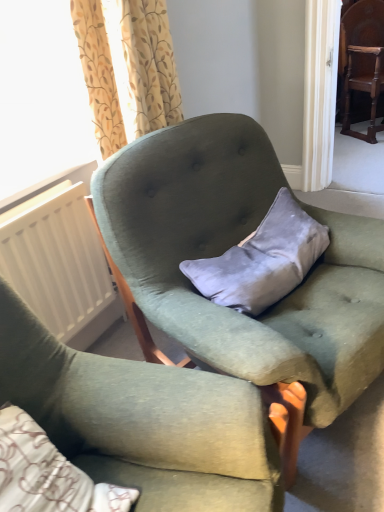
Describe the element at coordinates (142, 421) in the screenshot. I see `velvet green armchair at center, the 1th chair when ordered from front to back` at that location.

The width and height of the screenshot is (384, 512). What do you see at coordinates (228, 248) in the screenshot?
I see `velvet green armchair at center, the second chair positioned from the right` at bounding box center [228, 248].

Describe the element at coordinates (363, 59) in the screenshot. The height and width of the screenshot is (512, 384). I see `dark brown wood chair at upper right, the third chair in the front-to-back sequence` at that location.

You are a GUI agent. You are given a task and a screenshot of the screen. Output one action in this format:
    pyautogui.click(x=<x>, y=<y>)
    Task: Click on the velvet gray pillow at center
    
    Given the screenshot: What is the action you would take?
    pyautogui.click(x=262, y=260)

From a real-world perspective, who is located lower, white plastic radiator at left or velvet green armchair at center, placed as the second chair when sorted from front to back?

velvet green armchair at center, placed as the second chair when sorted from front to back, from a real-world perspective.

From the image's perspective, is white plastic radiator at left positioned above or below velvet green armchair at center, placed as the second chair when sorted from back to front?

Based on their image positions, white plastic radiator at left is located beneath velvet green armchair at center, placed as the second chair when sorted from back to front.

Is velvet green armchair at center, marked as the 2th chair in a top-to-bottom arrangement, a part of white plastic radiator at left?

No, white plastic radiator at left does not contain velvet green armchair at center, marked as the 2th chair in a top-to-bottom arrangement.

Considering the relative positions of white plastic radiator at left and velvet green armchair at center, the second chair positioned from the right, in the image provided, is white plastic radiator at left to the left of velvet green armchair at center, the second chair positioned from the right, from the viewer's perspective?

Indeed, white plastic radiator at left is positioned on the left side of velvet green armchair at center, the second chair positioned from the right.

Can you confirm if dark brown wood chair at upper right, which is the third chair from left to right, is taller than velvet green armchair at center, the 2th chair when ordered from bottom to top?

Indeed, dark brown wood chair at upper right, which is the third chair from left to right, has a greater height compared to velvet green armchair at center, the 2th chair when ordered from bottom to top.

How many degrees apart are the facing directions of dark brown wood chair at upper right, the third chair in the front-to-back sequence, and velvet green armchair at center, the second chair positioned from the right?

20.6 degrees separate the facing orientations of dark brown wood chair at upper right, the third chair in the front-to-back sequence, and velvet green armchair at center, the second chair positioned from the right.

Considering the sizes of objects dark brown wood chair at upper right, the 1th chair from the top, and velvet green armchair at center, which ranks as the 2th chair in left-to-right order, in the image provided, who is thinner, dark brown wood chair at upper right, the 1th chair from the top, or velvet green armchair at center, which ranks as the 2th chair in left-to-right order,?

dark brown wood chair at upper right, the 1th chair from the top.

From a real-world perspective, does dark brown wood chair at upper right, which appears as the first chair when viewed from the back, stand above velvet green armchair at center, which ranks as the 2th chair in left-to-right order?

Correct, in the physical world, dark brown wood chair at upper right, which appears as the first chair when viewed from the back, is higher than velvet green armchair at center, which ranks as the 2th chair in left-to-right order.

From a real-world perspective, is velvet green armchair at center, the second chair positioned from the right, under white plastic radiator at left?

Yes, from a real-world perspective, velvet green armchair at center, the second chair positioned from the right, is below white plastic radiator at left.

Between velvet green armchair at center, placed as the second chair when sorted from front to back, and white plastic radiator at left, which one has larger width?

velvet green armchair at center, placed as the second chair when sorted from front to back.

Could you tell me if velvet green armchair at center, which ranks as the 2th chair in left-to-right order, is facing white plastic radiator at left?

No, velvet green armchair at center, which ranks as the 2th chair in left-to-right order, is not facing towards white plastic radiator at left.

Considering the positions of objects white plastic radiator at left and floral-patterned fabric curtain at upper left in the image provided, who is more to the left, white plastic radiator at left or floral-patterned fabric curtain at upper left?

Positioned to the left is white plastic radiator at left.

Is white plastic radiator at left wider or thinner than floral-patterned fabric curtain at upper left?

In the image, white plastic radiator at left appears to be more narrow than floral-patterned fabric curtain at upper left.

Find the location of a particular element. radiator that is under the floral-patterned fabric curtain at upper left (from a real-world perspective) is located at coordinates (59, 265).

Does point (84, 213) come closer to viewer compared to point (117, 13)?

No, it is not.

Who is shorter, floral-patterned fabric curtain at upper left or velvet gray pillow at center?

velvet gray pillow at center is shorter.

From the picture: How far apart are floral-patterned fabric curtain at upper left and velvet gray pillow at center?

floral-patterned fabric curtain at upper left is 24.22 inches from velvet gray pillow at center.

Does floral-patterned fabric curtain at upper left turn towards velvet gray pillow at center?

Yes, floral-patterned fabric curtain at upper left is facing velvet gray pillow at center.

Is velvet green armchair at center, placed as the 3th chair when sorted from back to front, oriented away from velvet gray pillow at center?

That's not correct — velvet green armchair at center, placed as the 3th chair when sorted from back to front, is not looking away from velvet gray pillow at center.

How distant is velvet green armchair at center, the 1th chair when ordered from front to back, from velvet gray pillow at center?

The distance of velvet green armchair at center, the 1th chair when ordered from front to back, from velvet gray pillow at center is 18.98 inches.

Is point (185, 417) closer to camera compared to point (295, 243)?

Yes.

From a real-world perspective, is velvet green armchair at center, acting as the 3th chair starting from the top, physically above velvet gray pillow at center?

Actually, velvet green armchair at center, acting as the 3th chair starting from the top, is physically below velvet gray pillow at center in the real world.

Is velvet green armchair at center, the 2th chair when ordered from bottom to top, located within velvet gray pillow at center?

No, velvet green armchair at center, the 2th chair when ordered from bottom to top, is not surrounded by velvet gray pillow at center.

Considering the sizes of objects velvet gray pillow at center and velvet green armchair at center, the second chair positioned from the right, in the image provided, who is shorter, velvet gray pillow at center or velvet green armchair at center, the second chair positioned from the right,?

Standing shorter between the two is velvet gray pillow at center.

At what (x,y) coordinates should I click in order to perform the action: click on the 1st chair in front of the white plastic radiator at left. Please return your answer as a coordinate pair (x, y). Looking at the image, I should click on (228, 248).

Find the location of a particular element. This screenshot has width=384, height=512. the 1st chair to the left when counting from the dark brown wood chair at upper right, which is the third chair from left to right is located at coordinates (228, 248).

Which object lies nearer to the anchor point velvet green armchair at center, acting as the 3th chair starting from the top, floral-patterned fabric curtain at upper left or dark brown wood chair at upper right, the third chair in the front-to-back sequence?

floral-patterned fabric curtain at upper left is positioned closer to the anchor velvet green armchair at center, acting as the 3th chair starting from the top.

When comparing their distances from white plastic radiator at left, does dark brown wood chair at upper right, the third chair in the front-to-back sequence, or velvet green armchair at center, the 1th chair when ordered from front to back, seem further?

The object further to white plastic radiator at left is dark brown wood chair at upper right, the third chair in the front-to-back sequence.

When comparing their distances from velvet green armchair at center, the 2th chair when ordered from bottom to top, does velvet gray pillow at center or floral-patterned fabric curtain at upper left seem closer?

velvet gray pillow at center is positioned closer to the anchor velvet green armchair at center, the 2th chair when ordered from bottom to top.

When comparing their distances from velvet green armchair at center, the second chair positioned from the right, does white plastic radiator at left or velvet green armchair at center, acting as the 3th chair starting from the top, seem closer?

The object closer to velvet green armchair at center, the second chair positioned from the right, is velvet green armchair at center, acting as the 3th chair starting from the top.

When comparing their distances from dark brown wood chair at upper right, which appears as the first chair when viewed from the back, does velvet green armchair at center, marked as the 2th chair in a top-to-bottom arrangement, or white plastic radiator at left seem further?

white plastic radiator at left lies further to dark brown wood chair at upper right, which appears as the first chair when viewed from the back, than the other object.

Looking at this image, considering their positions, is dark brown wood chair at upper right, which is the third chair in bottom-to-top order, positioned further to floral-patterned fabric curtain at upper left than velvet green armchair at center, which is the 3th chair from right to left?

dark brown wood chair at upper right, which is the third chair in bottom-to-top order.

Looking at the image, which one is located closer to floral-patterned fabric curtain at upper left, white plastic radiator at left or velvet green armchair at center, placed as the second chair when sorted from front to back?

Based on the image, velvet green armchair at center, placed as the second chair when sorted from front to back, appears to be nearer to floral-patterned fabric curtain at upper left.

Considering their positions, is dark brown wood chair at upper right, which appears as the first chair when viewed from the back, positioned further to velvet green armchair at center, the 1th chair when ordered from left to right, than velvet gray pillow at center?

dark brown wood chair at upper right, which appears as the first chair when viewed from the back, lies further to velvet green armchair at center, the 1th chair when ordered from left to right, than the other object.

Locate an element on the screen. radiator between velvet green armchair at center, the 2th chair when ordered from bottom to top, and dark brown wood chair at upper right, the third chair in the front-to-back sequence, along the z-axis is located at coordinates (59, 265).

You are a GUI agent. You are given a task and a screenshot of the screen. Output one action in this format:
    pyautogui.click(x=<x>, y=<y>)
    Task: Click on the curtain between velvet green armchair at center, which ranks as the 2th chair in left-to-right order, and dark brown wood chair at upper right, the third chair in the front-to-back sequence, along the z-axis
    This screenshot has width=384, height=512.
    Given the screenshot: What is the action you would take?
    pyautogui.click(x=127, y=68)

This screenshot has width=384, height=512. What are the coordinates of `chair located between velvet green armchair at center, the 1th chair when ordered from front to back, and white plastic radiator at left in the depth direction` in the screenshot? It's located at (228, 248).

Image resolution: width=384 pixels, height=512 pixels. Identify the location of chair between floral-patterned fabric curtain at upper left and white plastic radiator at left vertically. pos(228,248).